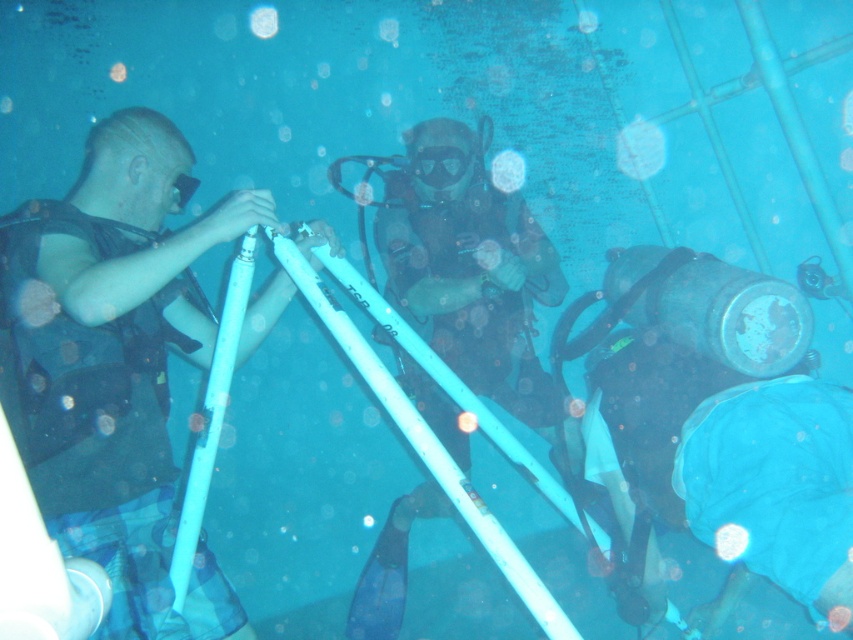
You are a scuba diver preparing to descend into the water. You see the transparent rubber mask at center and the transparent plastic bubble at upper center. Which object is closer to the left side of your view?

The transparent plastic bubble at upper center is closer to the left side of your view because the transparent rubber mask at center is to the right of it.

You are a scuba diver planning to take a photo of the transparent rubber mask at center and the transparent plastic bubble at upper center. Which object should you focus on first if you want to capture both in sharp detail without moving the camera?

The transparent rubber mask at center should be focused on first because it is much taller than the transparent plastic bubble at upper center, so focusing on the larger object ensures better sharpness for both.

You are a scuba diver trying to navigate underwater. You see two points marked in the scene. Which point is nearer to you, point at coordinate (x=171, y=545) or point at coordinate (x=451, y=161)?

Point at coordinate (x=171, y=545) is closer to the camera than point at coordinate (x=451, y=161), so the point at coordinate (x=171, y=545) is nearer to you.